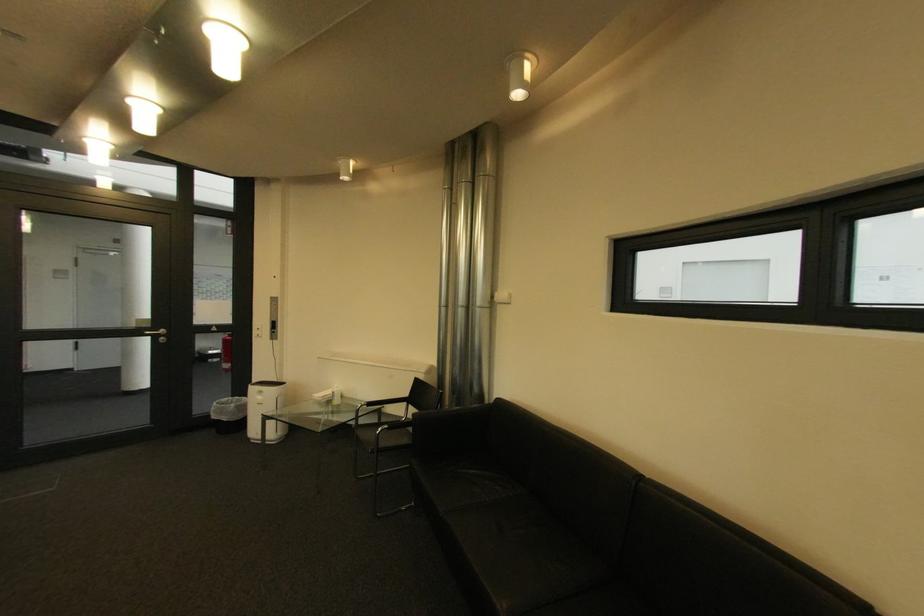
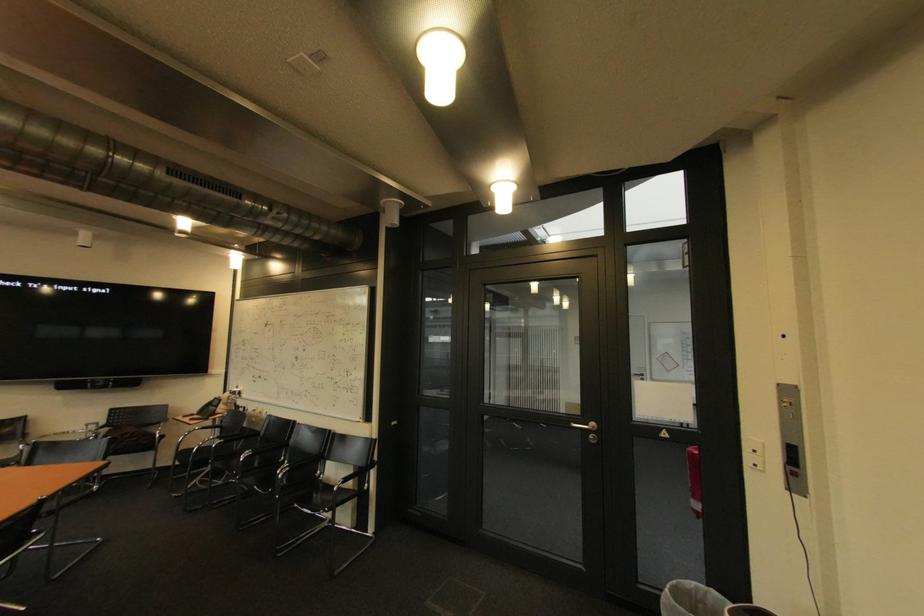
The point at (263, 334) is marked in the first image. Where is the corresponding point in the second image?

(757, 459)